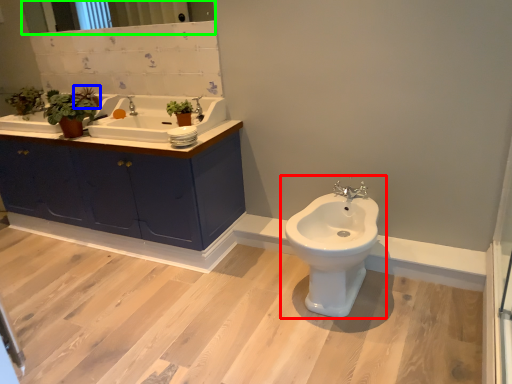
Question: Which is nearer to the toilet (highlighted by a red box)? plant (highlighted by a blue box) or mirror (highlighted by a green box).

Choices:
 (A) plant
 (B) mirror

Answer: (A)